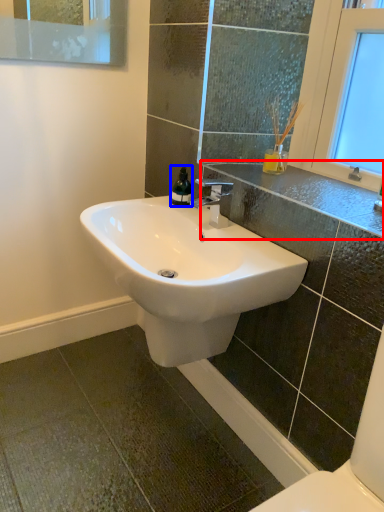
Question: Which object is further to the camera taking this photo, counter top (highlighted by a red box) or soap dispenser (highlighted by a blue box)?

Choices:
 (A) counter top
 (B) soap dispenser

Answer: (B)